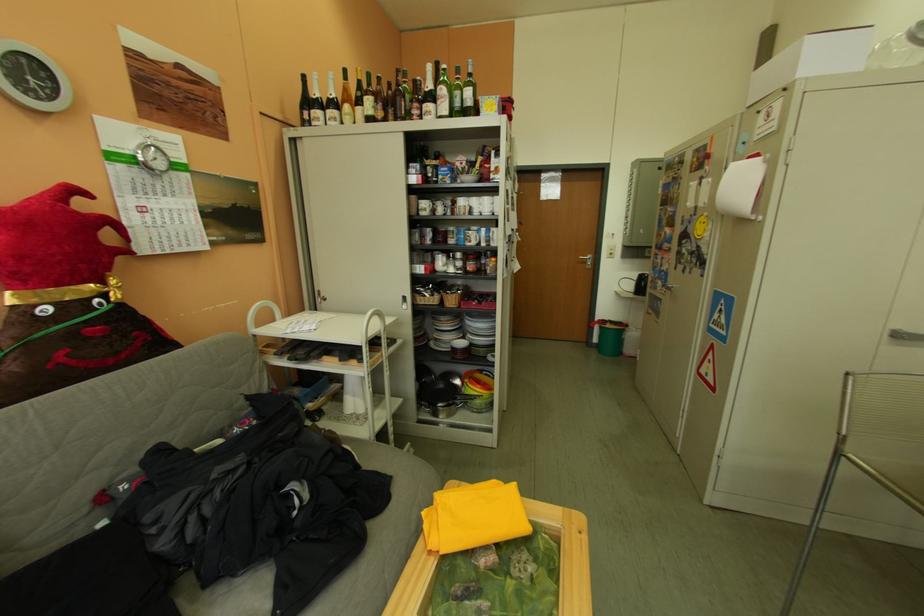
Find the location of a particular element. The width and height of the screenshot is (924, 616). plastic water bottle is located at coordinates (898, 49).